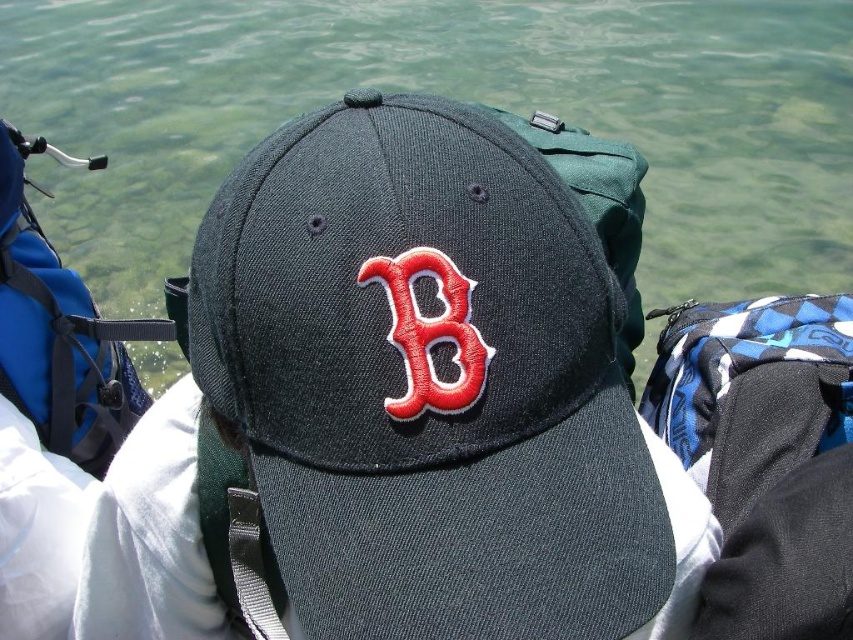
Question: Which object is farther from the camera taking this photo?

Choices:
 (A) dark gray fabric baseball cap at center
 (B) red fabric letter b at center

Answer: (B)

Question: Which point is closer to the camera taking this photo?

Choices:
 (A) (416, 368)
 (B) (463, 54)
 (C) (534, 568)

Answer: (C)

Question: Which object is positioned closest to the dark gray fabric baseball cap at center?

Choices:
 (A) red fabric letter b at center
 (B) clear water at center

Answer: (A)

Question: Is dark gray fabric baseball cap at center positioned in front of red fabric letter b at center?

Choices:
 (A) yes
 (B) no

Answer: (A)

Question: Is dark gray fabric baseball cap at center bigger than clear water at center?

Choices:
 (A) no
 (B) yes

Answer: (B)

Question: Considering the relative positions of clear water at center and red fabric letter b at center in the image provided, where is clear water at center located with respect to red fabric letter b at center?

Choices:
 (A) below
 (B) above

Answer: (B)